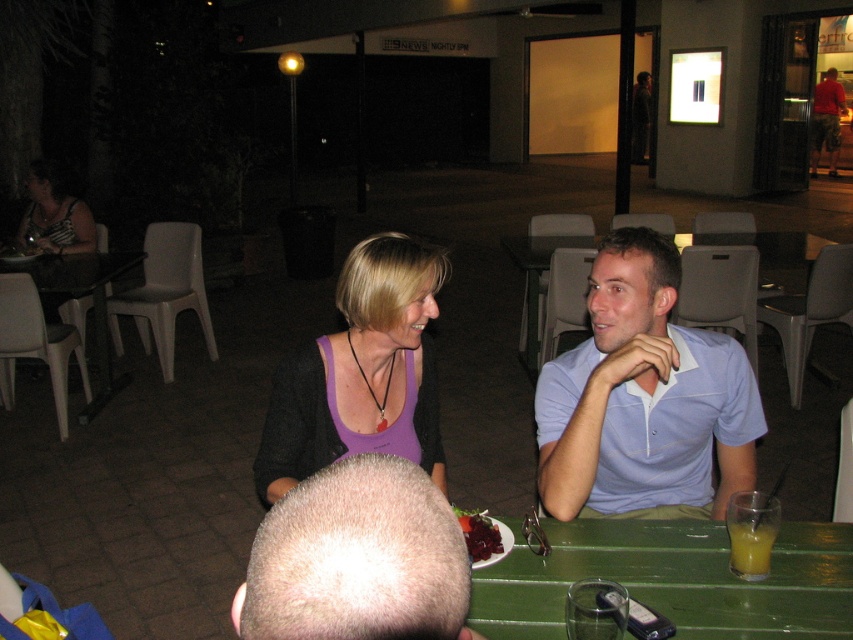
Question: Can you confirm if green plastic table at lower center is wider than purple fabric shirt at center?

Choices:
 (A) yes
 (B) no

Answer: (A)

Question: Observing the image, what is the correct spatial positioning of green plastic table at lower center in reference to smooth glossy red plate at center?

Choices:
 (A) above
 (B) below

Answer: (B)

Question: Which point is closer to the camera?

Choices:
 (A) (469, 547)
 (B) (585, 378)

Answer: (A)

Question: Is smooth bald head at center wider than translucent glass at table right?

Choices:
 (A) no
 (B) yes

Answer: (B)

Question: Which point is closer to the camera?

Choices:
 (A) (36, 204)
 (B) (416, 305)
 (C) (410, 561)

Answer: (C)

Question: Which of the following is the closest to the observer?

Choices:
 (A) smooth glossy red plate at center
 (B) light blue polo shirt at center

Answer: (A)